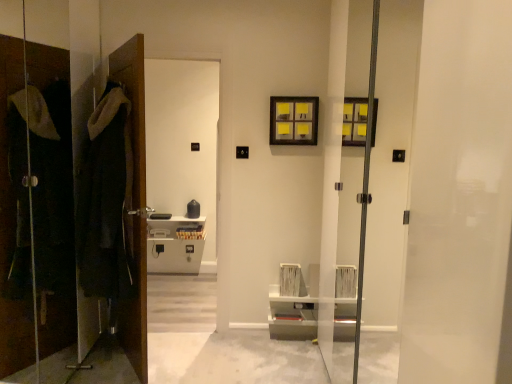
You are a GUI agent. You are given a task and a screenshot of the screen. Output one action in this format:
    pyautogui.click(x=<x>, y=<y>)
    Task: Click on the vacant space situated on the left part of brown wooden door at left
    This screenshot has height=384, width=512.
    Given the screenshot: What is the action you would take?
    pyautogui.click(x=105, y=354)